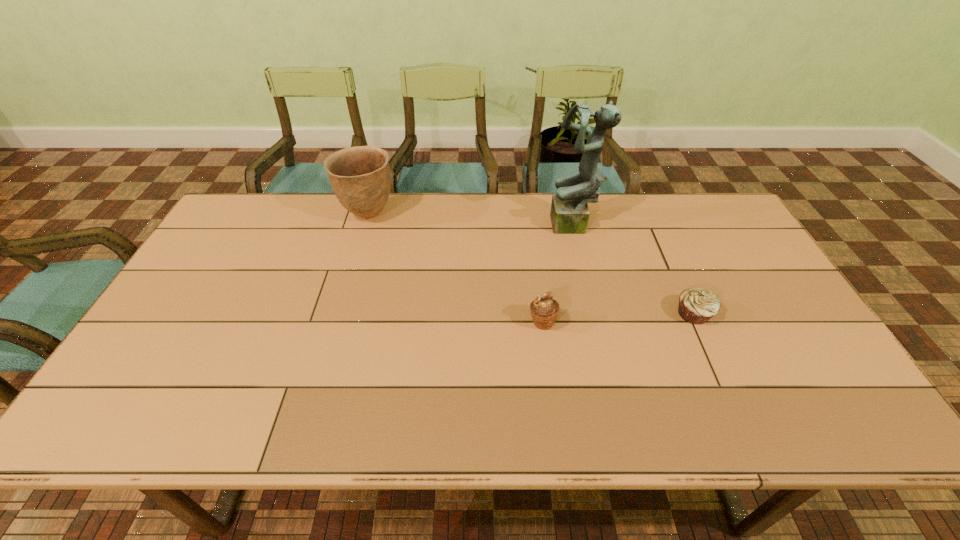
Where is `free space located 0.310m on the face of the sculpture`? free space located 0.310m on the face of the sculpture is located at coordinates [455, 227].

The image size is (960, 540). I want to click on vacant region located on the right of the leftmost object, so click(x=442, y=215).

This screenshot has width=960, height=540. Find the location of `vacant area located 0.250m on the right of the second shortest object`. vacant area located 0.250m on the right of the second shortest object is located at coordinates (652, 322).

Identify the location of free spot located on the right of the right muffin. Image resolution: width=960 pixels, height=540 pixels. (776, 314).

Locate an element on the screen. sculpture present at the far edge is located at coordinates (569, 214).

Locate an element on the screen. Image resolution: width=960 pixels, height=540 pixels. pottery that is positioned at the far edge is located at coordinates (360, 177).

At what (x,y) coordinates should I click in order to perform the action: click on blank space at the far edge. Please return your answer as a coordinate pair (x, y). Image resolution: width=960 pixels, height=540 pixels. Looking at the image, I should click on (324, 213).

This screenshot has height=540, width=960. Identify the location of vacant space at the near edge of the desktop. (310, 407).

In the image, there is a desktop. Where is `vacant space at the left edge`? vacant space at the left edge is located at coordinates (221, 265).

In the image, there is a desktop. Where is `vacant region at the right edge`? Image resolution: width=960 pixels, height=540 pixels. vacant region at the right edge is located at coordinates (810, 368).